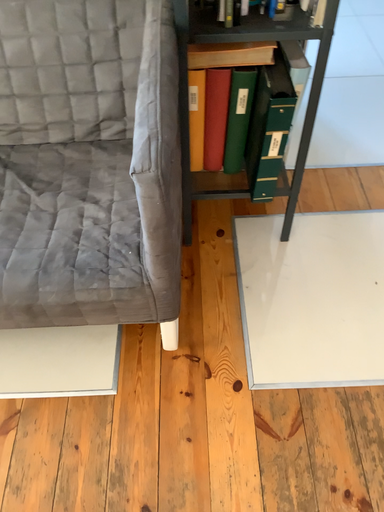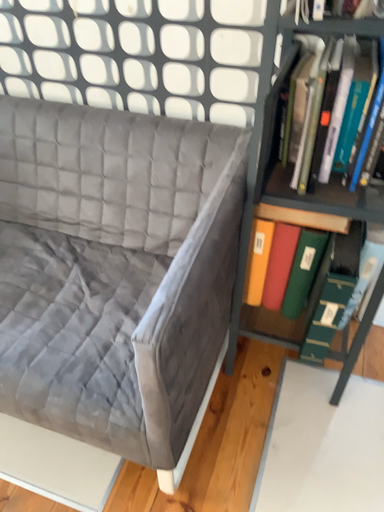
Question: Which way did the camera rotate in the video?

Choices:
 (A) rotated right
 (B) rotated left

Answer: (B)